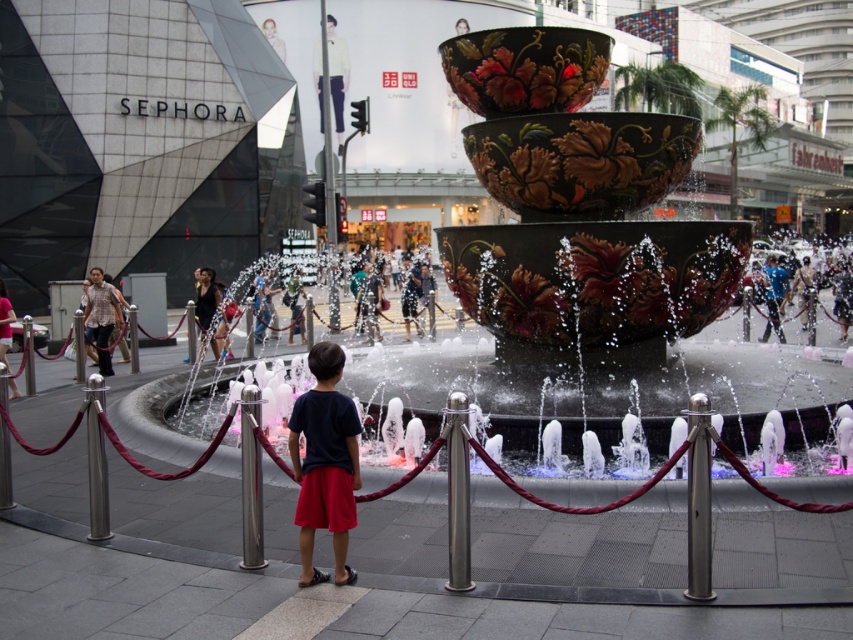
You are a photographer trying to capture the boy in the scene. The boy is wearing a dark blue fabric shirt at center and light beige fabric pants at upper center. Which piece of clothing is positioned lower on his body?

The dark blue fabric shirt at center is located below the light beige fabric pants at upper center, so the dark blue fabric shirt at center is positioned lower on his body.

You are standing in the urban scene looking at the dark blue fabric shirt at center. If you want to approach the shirt, how many steps would you need to take to reach it, assuming each step covers 0.8 meters?

The distance between you and the dark blue fabric shirt at center is 4.48 meters. Since each step covers 0.8 meters, dividing 4.48 by 0.8 gives 5.6 steps. Since you can only take whole steps, you would need to take 6 steps to reach the dark blue fabric shirt at center.

You are a delivery person with a cart that is 1.5 meters wide. You need to navigate through the space between the brushed metal pole at center and the matte black shirt at left. Can your cart fit through the gap between them?

The distance between the brushed metal pole at center and the matte black shirt at left is 9.12 meters, which is significantly wider than the cart width of 1.5 meters. Yes, the cart can easily pass through the gap between them.